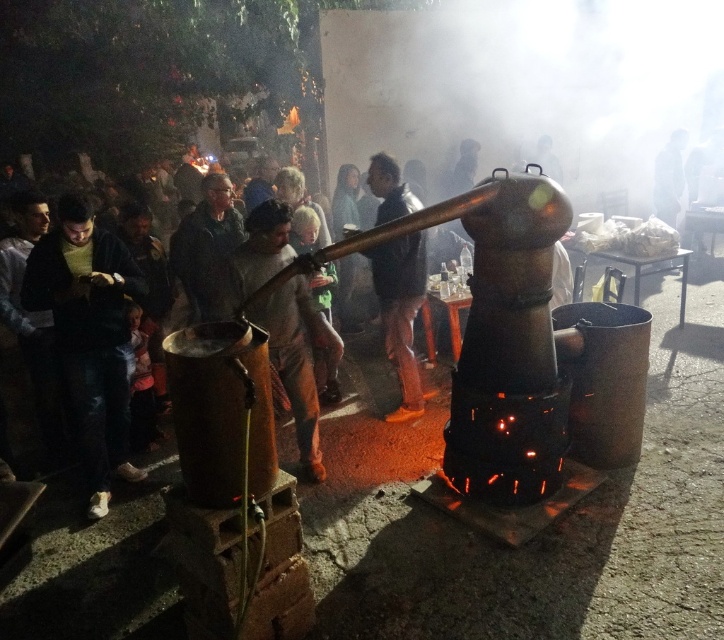
Question: Is dark green sweater at left closer to camera compared to dark gray jacket at center?

Choices:
 (A) yes
 (B) no

Answer: (A)

Question: Is shiny black pants at center bigger than dark gray jacket at center?

Choices:
 (A) yes
 (B) no

Answer: (A)

Question: Which point is farther from the camera taking this photo?

Choices:
 (A) (90, 285)
 (B) (408, 406)
 (C) (206, 228)

Answer: (B)

Question: Which point is farther to the camera?

Choices:
 (A) dark gray jacket at center
 (B) dark green sweater at left
 (C) shiny black pants at center

Answer: (A)

Question: Which of the following is the closest to the observer?

Choices:
 (A) (224, 234)
 (B) (50, 262)
 (C) (413, 300)

Answer: (B)

Question: Does shiny black pants at center have a larger size compared to dark gray jacket at center?

Choices:
 (A) yes
 (B) no

Answer: (A)